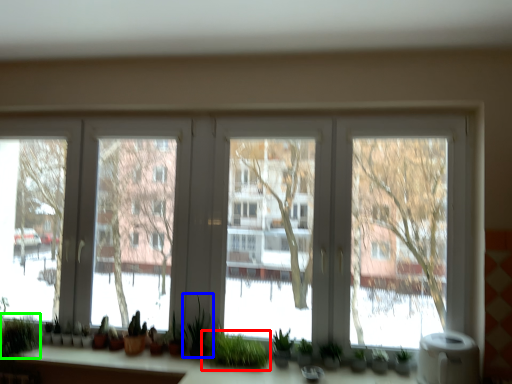
Question: Based on their relative distances, which object is farther from houseplant (highlighted by a red box)? Choose from plant (highlighted by a blue box) and plant (highlighted by a green box).

Choices:
 (A) plant
 (B) plant

Answer: (B)